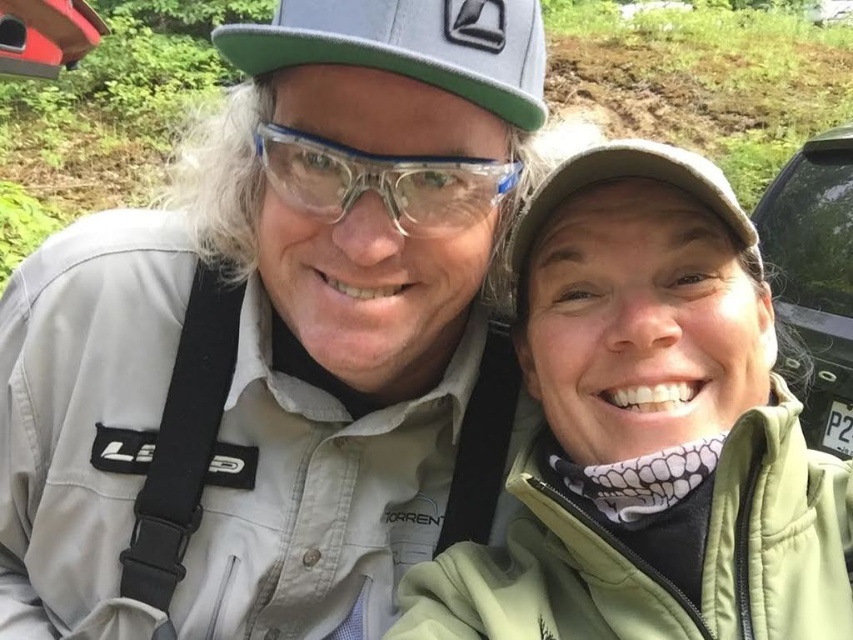
Consider the image. Between green fleece jacket at upper right and green matte car at right, which one is positioned higher?

green matte car at right is above.

The width and height of the screenshot is (853, 640). Describe the element at coordinates (648, 432) in the screenshot. I see `green fleece jacket at upper right` at that location.

Where is `green fleece jacket at upper right`? This screenshot has width=853, height=640. green fleece jacket at upper right is located at coordinates (648, 432).

You are a GUI agent. You are given a task and a screenshot of the screen. Output one action in this format:
    pyautogui.click(x=<x>, y=<y>)
    Task: Click on the green fleece jacket at upper right
    Image resolution: width=853 pixels, height=640 pixels.
    Given the screenshot: What is the action you would take?
    pyautogui.click(x=648, y=432)

What do you see at coordinates (409, 45) in the screenshot?
I see `gray matte baseball cap at upper center` at bounding box center [409, 45].

Between gray matte baseball cap at upper center and clear plastic goggles at center, which one is positioned lower?

Positioned lower is clear plastic goggles at center.

The image size is (853, 640). Describe the element at coordinates (409, 45) in the screenshot. I see `gray matte baseball cap at upper center` at that location.

Find the location of `gray matte baseball cap at upper center`. gray matte baseball cap at upper center is located at coordinates (409, 45).

Between matte khaki jacket at left and green fleece jacket at upper right, which one has more height?

matte khaki jacket at left is taller.

Does point (434, 244) lie in front of point (753, 339)?

No.

Who is more distant from viewer, (157, 394) or (735, 525)?

The point (157, 394) is behind.

This screenshot has width=853, height=640. Identify the location of matte khaki jacket at left. (277, 340).